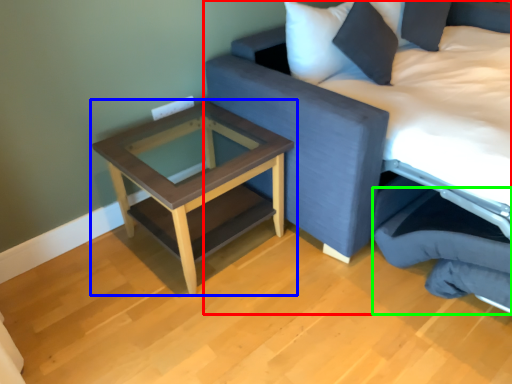
Question: Considering the real-world distances, which object is farthest from studio couch (highlighted by a red box)? table (highlighted by a blue box) or swivel chair (highlighted by a green box)?

Choices:
 (A) table
 (B) swivel chair

Answer: (A)